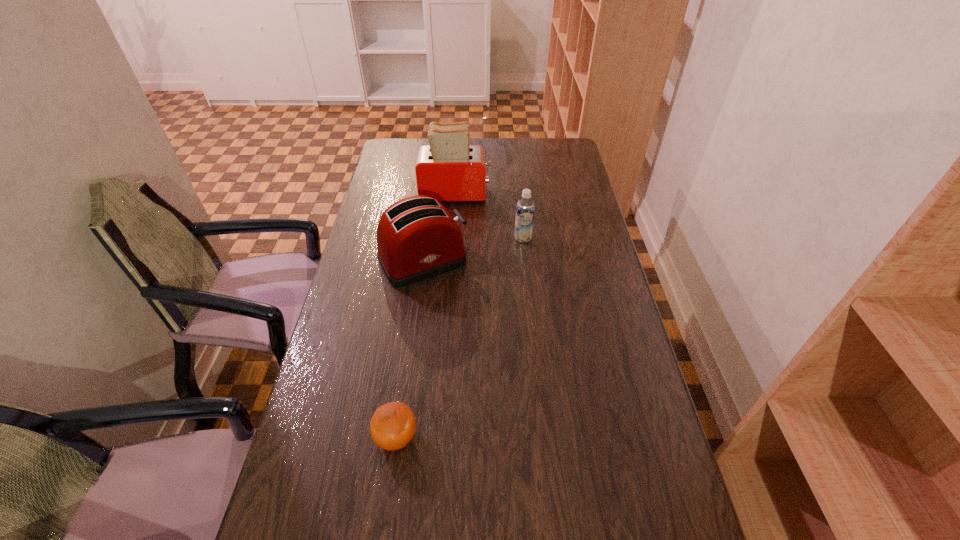
You are a GUI agent. You are given a task and a screenshot of the screen. Output one action in this format:
    pyautogui.click(x=<x>, y=<y>)
    Task: Click on the farthest object
    This screenshot has width=960, height=540.
    Given the screenshot: What is the action you would take?
    pyautogui.click(x=449, y=169)

Locate an element on the screen. This screenshot has width=960, height=540. the farther toaster is located at coordinates (449, 169).

This screenshot has height=540, width=960. I want to click on the nearer toaster, so click(x=417, y=238).

Identify the location of the rightmost object. Image resolution: width=960 pixels, height=540 pixels. (525, 209).

This screenshot has width=960, height=540. In order to click on orange in this screenshot , I will do click(393, 425).

This screenshot has height=540, width=960. In order to click on the shortest object in this screenshot , I will do `click(393, 425)`.

Locate an element on the screen. The width and height of the screenshot is (960, 540). free space located on the front-facing side of the farther toaster is located at coordinates (516, 194).

I want to click on vacant space located 0.360m on the back of the nearer toaster, so click(x=434, y=180).

Find the location of `free region located on the label of the rightmost object`. free region located on the label of the rightmost object is located at coordinates (527, 279).

The height and width of the screenshot is (540, 960). Identify the location of vacant space located 0.110m on the left of the orange. (329, 437).